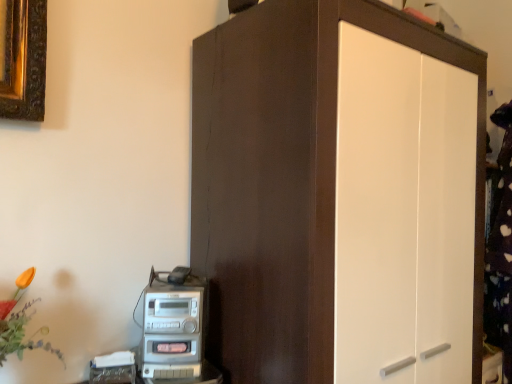
This screenshot has height=384, width=512. What do you see at coordinates (172, 329) in the screenshot?
I see `silver metallic stereo at lower left` at bounding box center [172, 329].

Where is `silver metallic stereo at lower left`? silver metallic stereo at lower left is located at coordinates (172, 329).

Locate an element on the screen. The image size is (512, 384). matte brown cupboard at center is located at coordinates (339, 195).

Describe the element at coordinates (339, 195) in the screenshot. I see `matte brown cupboard at center` at that location.

Image resolution: width=512 pixels, height=384 pixels. I want to click on silver metallic stereo at lower left, so click(x=172, y=329).

Based on their positions, is matte brown cupboard at center located to the left or right of silver metallic stereo at lower left?

matte brown cupboard at center is positioned on silver metallic stereo at lower left's right side.

Which object is further away from the camera, matte brown cupboard at center or silver metallic stereo at lower left?

silver metallic stereo at lower left is more distant.

Is point (279, 375) behind point (152, 284)?

No, (279, 375) is closer to viewer.

From the image's perspective, which one is positioned higher, matte brown cupboard at center or silver metallic stereo at lower left?

matte brown cupboard at center is shown above in the image.

From a real-world perspective, which is physically above, matte brown cupboard at center or silver metallic stereo at lower left?

In real-world perspective, matte brown cupboard at center is above.

Does matte brown cupboard at center have a lesser width compared to silver metallic stereo at lower left?

No.

Is matte brown cupboard at center taller or shorter than silver metallic stereo at lower left?

In the image, matte brown cupboard at center appears to be taller than silver metallic stereo at lower left.

Considering the sizes of objects matte brown cupboard at center and silver metallic stereo at lower left in the image provided, who is bigger, matte brown cupboard at center or silver metallic stereo at lower left?

matte brown cupboard at center is bigger.

Could silver metallic stereo at lower left be considered to be inside matte brown cupboard at center?

No.

Is matte brown cupboard at center next to silver metallic stereo at lower left and touching it?

matte brown cupboard at center and silver metallic stereo at lower left are not in contact.

Is silver metallic stereo at lower left at the back of matte brown cupboard at center?

No, matte brown cupboard at center is not facing away from silver metallic stereo at lower left.

Where is `cupboard lying in front of the silver metallic stereo at lower left`? This screenshot has width=512, height=384. cupboard lying in front of the silver metallic stereo at lower left is located at coordinates (339, 195).

Which object is positioned more to the right, silver metallic stereo at lower left or matte brown cupboard at center?

matte brown cupboard at center is more to the right.

Considering the positions of objects silver metallic stereo at lower left and matte brown cupboard at center in the image provided, who is in front, silver metallic stereo at lower left or matte brown cupboard at center?

matte brown cupboard at center is closer to the camera.

Is point (164, 311) closer or farther from the camera than point (277, 230)?

Clearly, point (164, 311) is more distant from the camera than point (277, 230).

From the image's perspective, is silver metallic stereo at lower left located above or below matte brown cupboard at center?

From the image's perspective, silver metallic stereo at lower left appears below matte brown cupboard at center.

From a real-world perspective, is silver metallic stereo at lower left located higher than matte brown cupboard at center?

Incorrect, from a real-world perspective, silver metallic stereo at lower left is lower than matte brown cupboard at center.

Considering the relative sizes of silver metallic stereo at lower left and matte brown cupboard at center in the image provided, is silver metallic stereo at lower left thinner than matte brown cupboard at center?

Indeed, silver metallic stereo at lower left has a lesser width compared to matte brown cupboard at center.

Considering the relative sizes of silver metallic stereo at lower left and matte brown cupboard at center in the image provided, is silver metallic stereo at lower left taller than matte brown cupboard at center?

In fact, silver metallic stereo at lower left may be shorter than matte brown cupboard at center.

Considering the sizes of silver metallic stereo at lower left and matte brown cupboard at center in the image, is silver metallic stereo at lower left bigger or smaller than matte brown cupboard at center?

In the image, silver metallic stereo at lower left appears to be smaller than matte brown cupboard at center.

Is matte brown cupboard at center inside silver metallic stereo at lower left?

No, matte brown cupboard at center is located outside of silver metallic stereo at lower left.

Can you see silver metallic stereo at lower left touching matte brown cupboard at center?

No, silver metallic stereo at lower left is not touching matte brown cupboard at center.

Could you tell me if silver metallic stereo at lower left is facing matte brown cupboard at center?

No, silver metallic stereo at lower left is not turned towards matte brown cupboard at center.

How many degrees apart are the facing directions of silver metallic stereo at lower left and matte brown cupboard at center?

There is a 32.1-degree angle between the facing directions of silver metallic stereo at lower left and matte brown cupboard at center.

This screenshot has width=512, height=384. In the image, there is a matte brown cupboard at center. What are the coordinates of `home appliance below it (from the image's perspective)` in the screenshot? It's located at pos(172,329).

The height and width of the screenshot is (384, 512). I want to click on home appliance that is on the left side of matte brown cupboard at center, so click(x=172, y=329).

Locate an element on the screen. home appliance that appears below the matte brown cupboard at center (from a real-world perspective) is located at coordinates (172, 329).